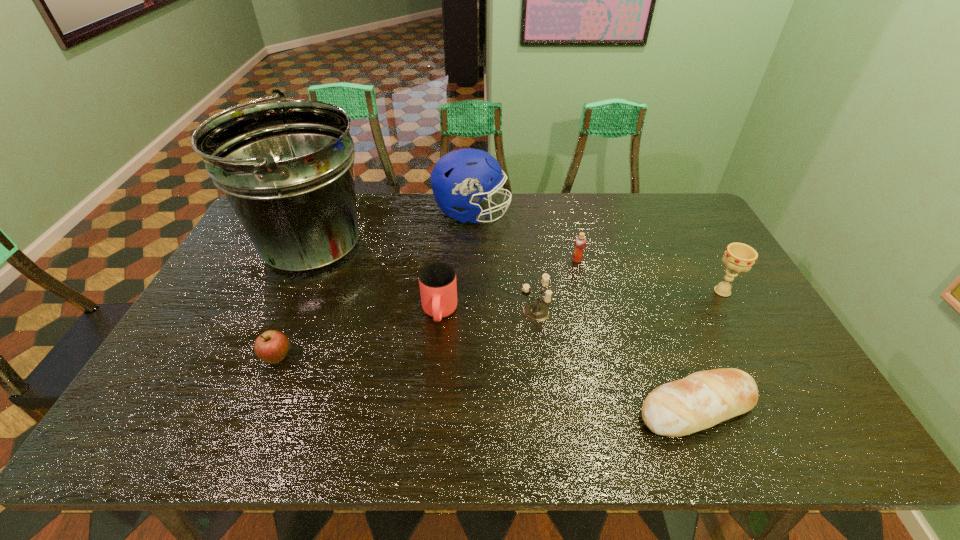
Where is `free region located 0.060m on the back of the bucket`? The height and width of the screenshot is (540, 960). free region located 0.060m on the back of the bucket is located at coordinates (333, 202).

Locate an element on the screen. vacant space situated 0.400m on the front-facing side of the second tallest object is located at coordinates (621, 213).

Locate an element on the screen. This screenshot has height=540, width=960. free region located 0.130m on the front of the rightmost object is located at coordinates (748, 336).

What are the coordinates of `free space located 0.140m on the handle side of the cup` in the screenshot? It's located at (434, 376).

This screenshot has width=960, height=540. I want to click on blank space located on the right of the candle holder, so click(x=658, y=311).

The width and height of the screenshot is (960, 540). Identify the location of free space located 0.190m on the left of the third object from right to left. (512, 260).

Where is `vacant space situated on the left of the apple`? This screenshot has height=540, width=960. vacant space situated on the left of the apple is located at coordinates coord(219,358).

The image size is (960, 540). Find the location of `vacant region located 0.350m on the left of the nearest object`. vacant region located 0.350m on the left of the nearest object is located at coordinates (484, 408).

At what (x,y) coordinates should I click in order to perform the action: click on bucket that is positioned at the far edge. Please return your answer as a coordinate pair (x, y). Image resolution: width=960 pixels, height=540 pixels. Looking at the image, I should click on (285, 167).

Identify the location of football helmet that is at the far edge. Image resolution: width=960 pixels, height=540 pixels. (458, 179).